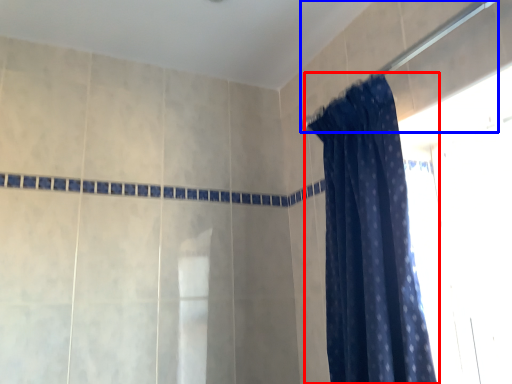
Question: Which object appears closest to the camera in this image, curtain (highlighted by a red box) or shower (highlighted by a blue box)?

Choices:
 (A) curtain
 (B) shower

Answer: (B)